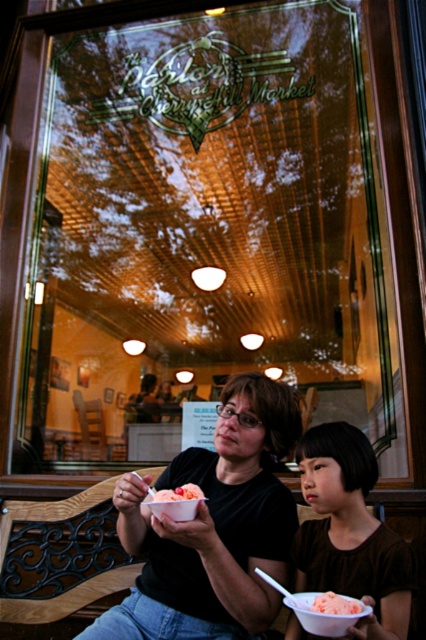
You are a customer at the Parlor at Cherry Hill Market. You see the brown matte shirt at lower right and the pink ice cream at lower center. Which object is closer to you from your perspective?

The brown matte shirt at lower right is closer to you because it is in front of the pink ice cream at lower center.

You are a photographer trying to capture a closeup shot of the pink ice cream at lower center without including the brown matte shirt at lower right in the frame. Based on their positions and sizes, is this possible?

The brown matte shirt at lower right might be wider than pink ice cream at lower center, so there is a possibility that the shirt could block the view of the ice cream. To ensure the ice cream is fully visible, adjust your angle or position to avoid the shirt.